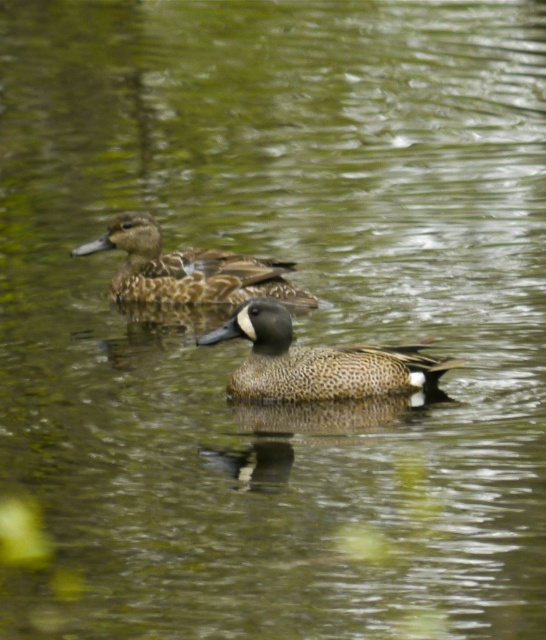
Can you confirm if speckled feathered duck at center is positioned to the right of brown speckled duck at upper center?

Indeed, speckled feathered duck at center is positioned on the right side of brown speckled duck at upper center.

What are the coordinates of `speckled feathered duck at center` in the screenshot? It's located at (317, 362).

Between point (388, 349) and point (235, 280), which one is positioned in front?

Point (388, 349)

Locate an element on the screen. speckled feathered duck at center is located at coordinates (317, 362).